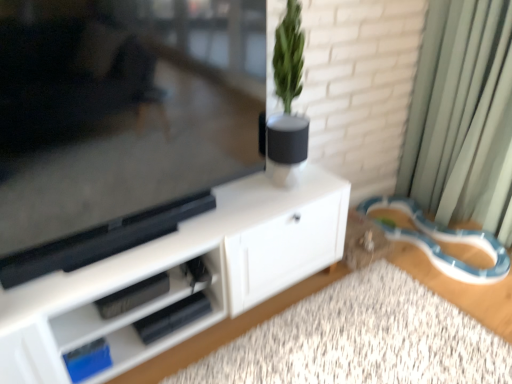
Question: Is white matte cabinet at center wider than white matte vase at center?

Choices:
 (A) yes
 (B) no

Answer: (A)

Question: Does white matte cabinet at center lie behind white matte vase at center?

Choices:
 (A) no
 (B) yes

Answer: (A)

Question: Can you confirm if white matte cabinet at center is shorter than white matte vase at center?

Choices:
 (A) yes
 (B) no

Answer: (B)

Question: Is white matte cabinet at center positioned in front of white matte vase at center?

Choices:
 (A) yes
 (B) no

Answer: (A)

Question: Is white matte cabinet at center next to white matte vase at center?

Choices:
 (A) yes
 (B) no

Answer: (B)

Question: Considering the positions of white matte carpet at lower center and blue plastic leash at lower right in the image, is white matte carpet at lower center wider or thinner than blue plastic leash at lower right?

Choices:
 (A) wide
 (B) thin

Answer: (B)

Question: Considering their positions, is white matte carpet at lower center located in front of or behind blue plastic leash at lower right?

Choices:
 (A) front
 (B) behind

Answer: (A)

Question: From the image's perspective, relative to blue plastic leash at lower right, is white matte carpet at lower center above or below?

Choices:
 (A) above
 (B) below

Answer: (B)

Question: Based on their positions, is white matte carpet at lower center located to the left or right of blue plastic leash at lower right?

Choices:
 (A) right
 (B) left

Answer: (B)

Question: Is white matte cabinet at center taller or shorter than white matte carpet at lower center?

Choices:
 (A) tall
 (B) short

Answer: (A)

Question: From a real-world perspective, is white matte cabinet at center positioned above or below white matte carpet at lower center?

Choices:
 (A) below
 (B) above

Answer: (B)

Question: Is white matte cabinet at center situated inside white matte carpet at lower center or outside?

Choices:
 (A) outside
 (B) inside

Answer: (A)

Question: Looking at their shapes, would you say white matte cabinet at center is wider or thinner than white matte carpet at lower center?

Choices:
 (A) wide
 (B) thin

Answer: (B)

Question: Is white matte cabinet at center situated inside green fabric curtain at right or outside?

Choices:
 (A) outside
 (B) inside

Answer: (A)

Question: Is white matte cabinet at center bigger or smaller than green fabric curtain at right?

Choices:
 (A) big
 (B) small

Answer: (A)